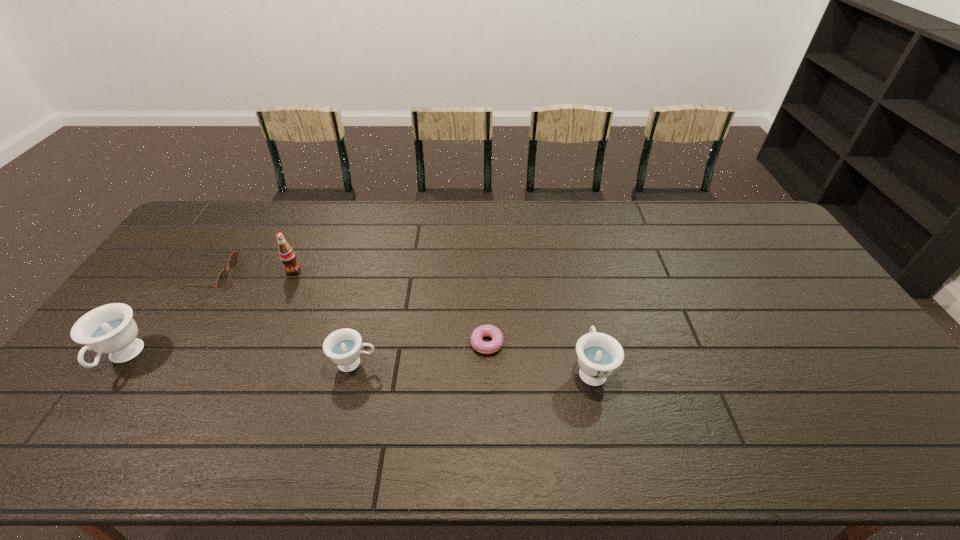
Image resolution: width=960 pixels, height=540 pixels. I want to click on object present at the near left corner, so click(110, 329).

Locate an element on the screen. This screenshot has width=960, height=540. vacant space at the far edge of the desktop is located at coordinates (667, 224).

In the image, there is a desktop. Where is `vacant region at the near edge`? Image resolution: width=960 pixels, height=540 pixels. vacant region at the near edge is located at coordinates (799, 397).

Image resolution: width=960 pixels, height=540 pixels. I want to click on vacant space at the left edge of the desktop, so click(208, 258).

In the image, there is a desktop. What are the coordinates of `vacant space at the right edge` in the screenshot? It's located at (772, 253).

Identify the location of vacant point located between the second object from right to left and the leftmost teacup. The image size is (960, 540). (303, 350).

Find the location of `vacant area that lies between the leftmost teacup and the third shortest object`. vacant area that lies between the leftmost teacup and the third shortest object is located at coordinates (239, 360).

Locate an element on the screen. This screenshot has width=960, height=540. free point between the fifth tallest object and the fifth object from left to right is located at coordinates (348, 309).

Image resolution: width=960 pixels, height=540 pixels. Find the location of `free point between the leftmost teacup and the fifth tallest object`. free point between the leftmost teacup and the fifth tallest object is located at coordinates (168, 316).

Where is `blank region between the leftmost teacup and the tallest object`? This screenshot has height=540, width=960. blank region between the leftmost teacup and the tallest object is located at coordinates (208, 314).